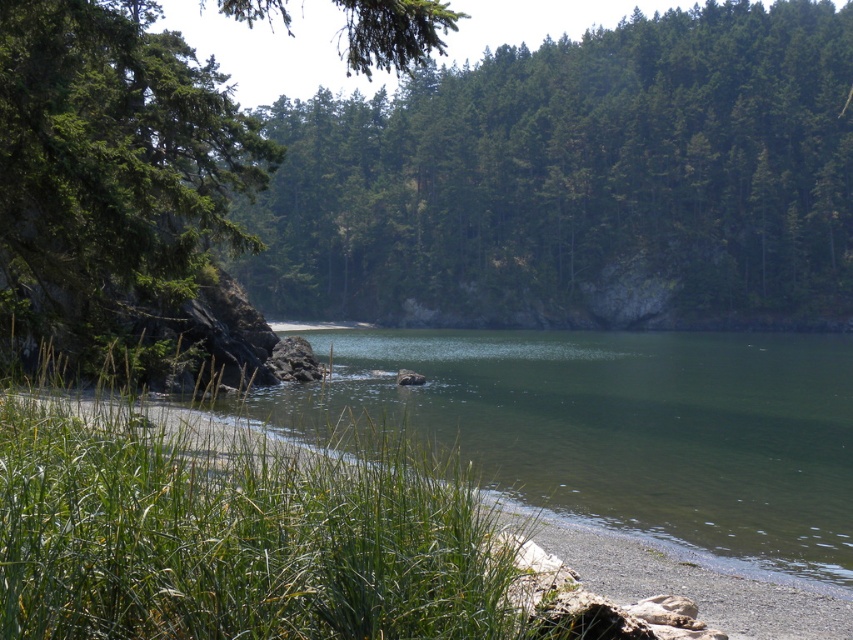
Question: Which of the following is the farthest from the observer?

Choices:
 (A) green textured tree at upper center
 (B) green grass at lower left

Answer: (A)

Question: Is green textured tree at upper center thinner than green matte tree at upper left?

Choices:
 (A) yes
 (B) no

Answer: (B)

Question: Which of these objects is positioned farthest from the green matte tree at upper left?

Choices:
 (A) green textured tree at upper center
 (B) green grass at lower left

Answer: (A)

Question: Which point appears closest to the camera in this image?

Choices:
 (A) (761, 122)
 (B) (254, 19)
 (C) (428, 508)

Answer: (C)

Question: Can you confirm if green grass at lower left is wider than green matte tree at upper left?

Choices:
 (A) no
 (B) yes

Answer: (A)

Question: Is green textured tree at upper center wider than green matte tree at upper left?

Choices:
 (A) yes
 (B) no

Answer: (A)